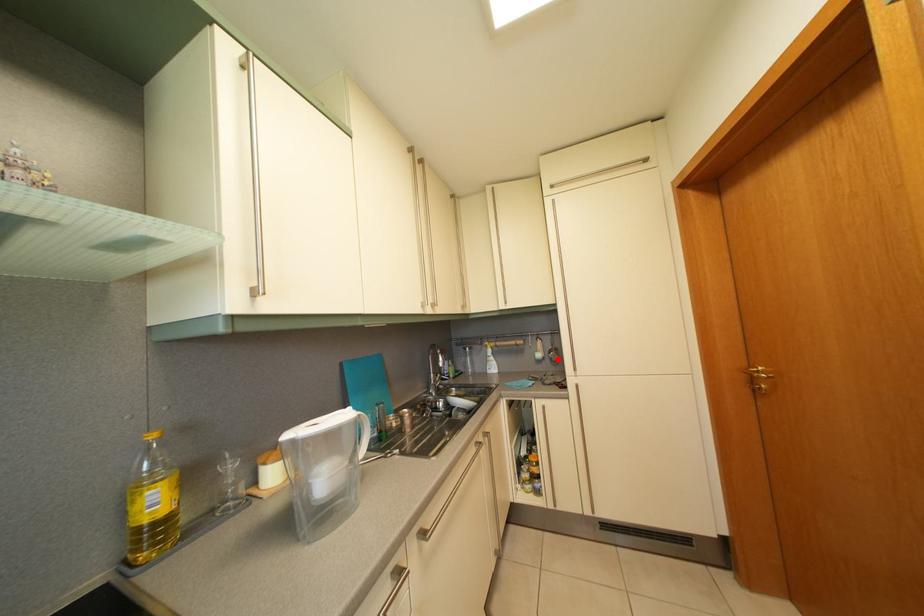
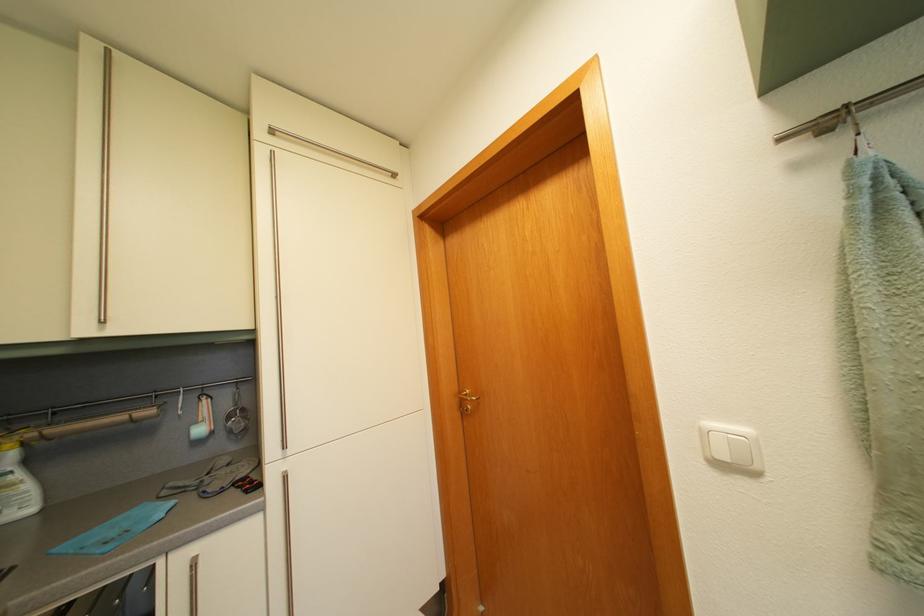
The point at the highlighted location is marked in the first image. Where is the corresponding point in the second image?

(237, 424)